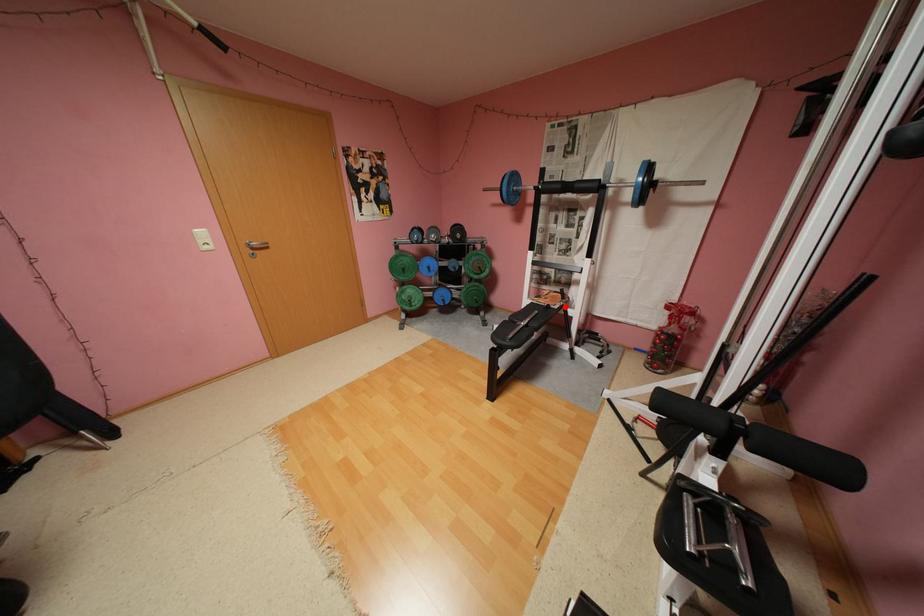
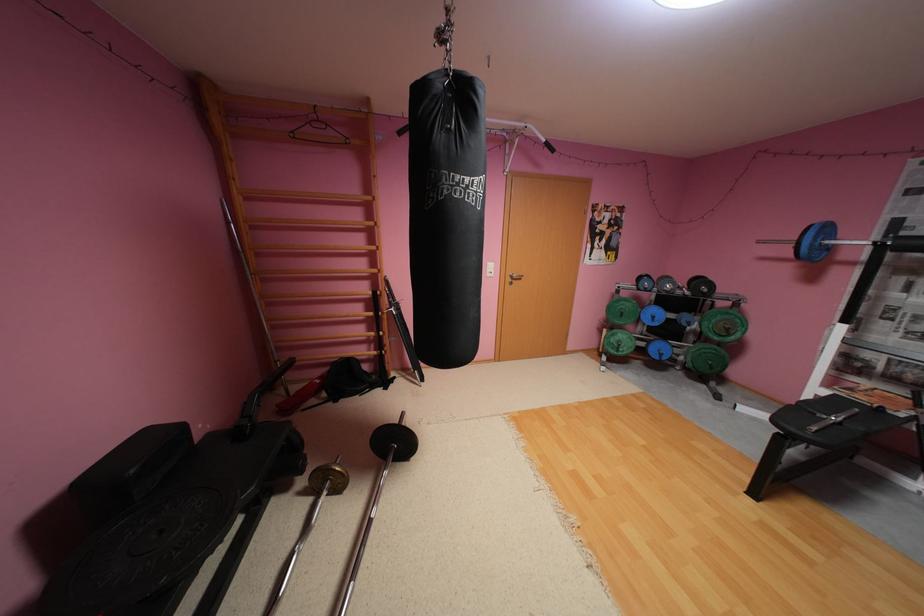
The point at the highlighted location is marked in the first image. Where is the corresponding point in the second image?

(909, 415)